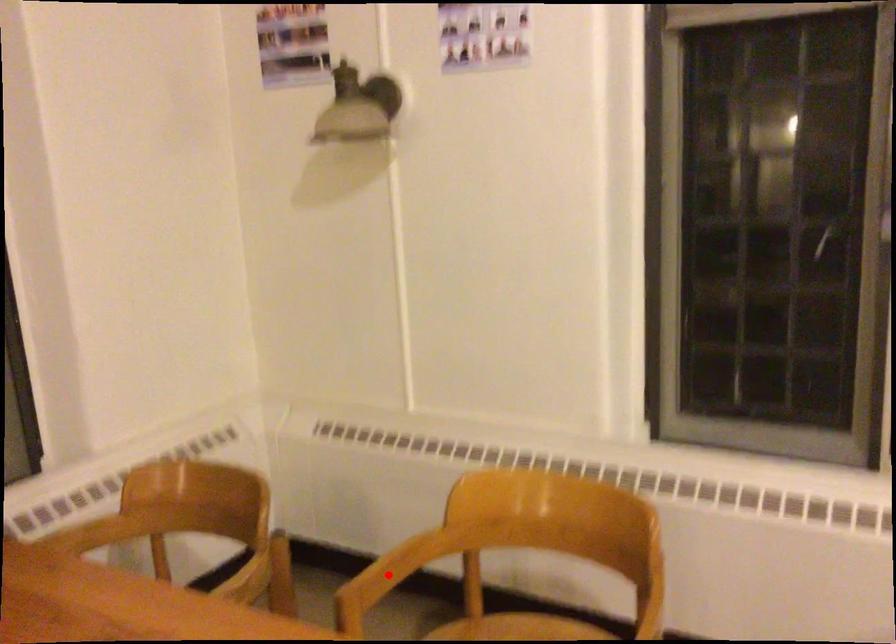
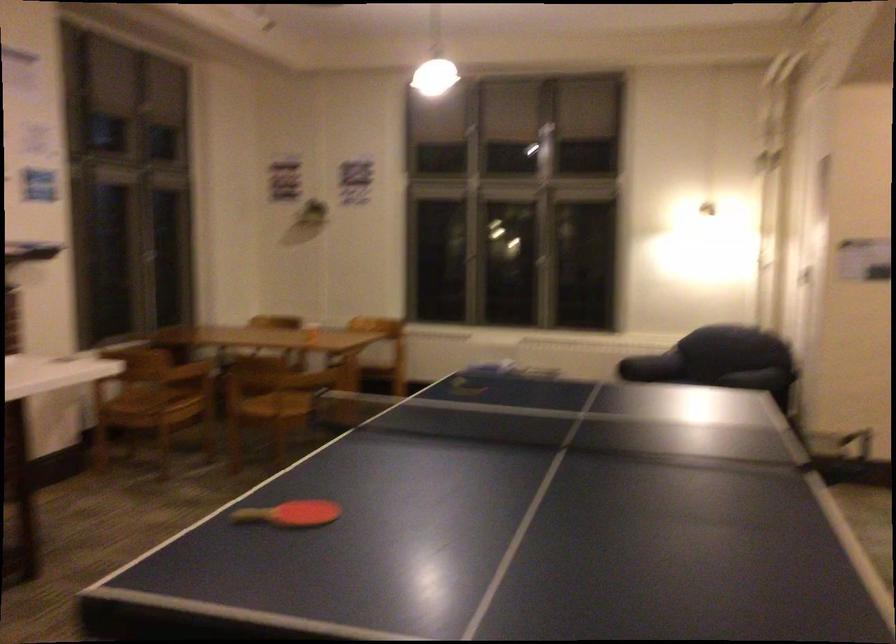
Question: I am providing you with two images of the same scene from different viewpoints. A red point is marked on the first image. At the location where the point appears in image 1, is it still visible in image 2?

Choices:
 (A) Yes
 (B) No

Answer: (B)